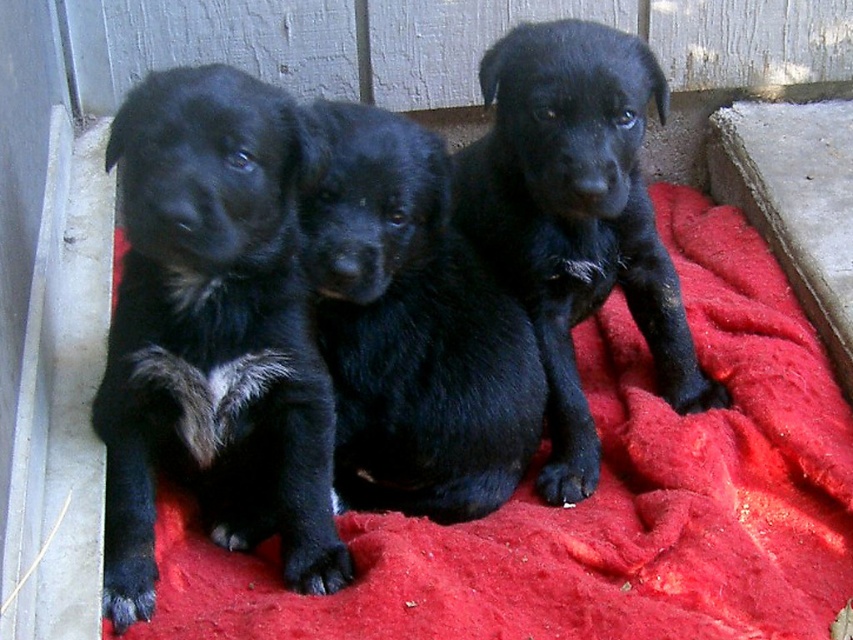
You are standing in front of the image and want to locate the black fur puppy at left. Can you tell me its coordinates?

The black fur puppy at left is located at coordinates point (x=215, y=332).

You are a photographer trying to capture all three puppies on a single photo. The black furry dog at center and the matte black puppy at center are the two main subjects. Given their sizes, will you need to adjust your camera angle to ensure both fit comfortably in the frame?

The black furry dog at center occupies less space than the matte black puppy at center, so adjusting the camera angle might not be necessary to include both, but ensure the matte black puppy at center is fully visible as it is larger.